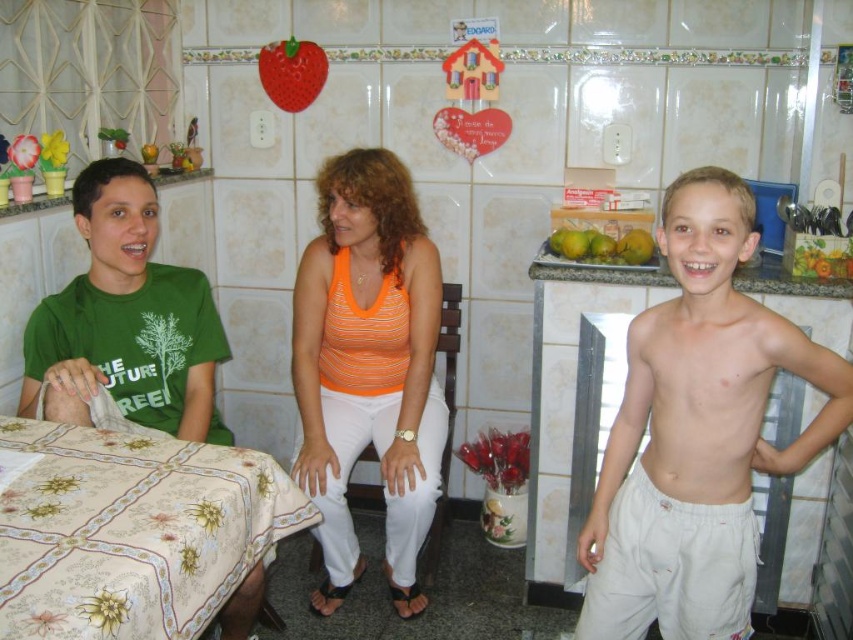
You are a chef preparing a fruit platter and need to arrange the rubber strawberry at upper center and the green matte mangoes at upper right. According to their current positions, which fruit is on the left side?

The rubber strawberry at upper center is positioned on the left side of green matte mangoes at upper right.

You are a chef preparing to place a rubber strawberry at upper center onto a dish that requires it to be exactly 12 inches away from the orange striped tank top at center. Can you place it correctly based on the current distance?

The distance between the orange striped tank top at center and the rubber strawberry at upper center is currently 35.83 inches, which is much greater than the required 12 inches. Therefore, you need to move the rubber strawberry at upper center closer to the orange striped tank top at center to achieve the desired distance.

You are standing at the center of the room and want to move to the point marked as point (x=271, y=42). Is this point located behind or in front of the point marked as point (x=566, y=240)?

The point marked as point (x=271, y=42) is behind the point marked as point (x=566, y=240).